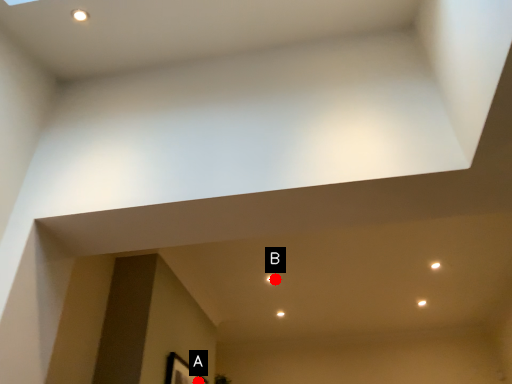
Question: Two points are circled on the image, labeled by A and B beside each circle. Which of the following is the farthest from the observer?

Choices:
 (A) A is further
 (B) B is further

Answer: (B)